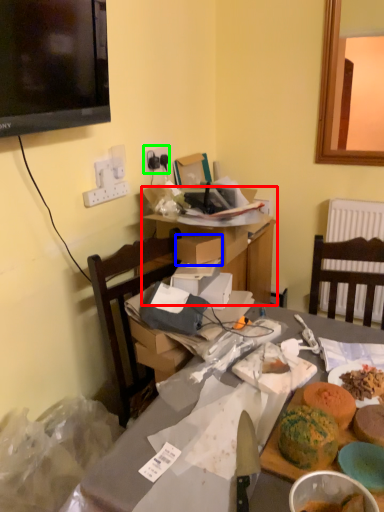
Question: Estimate the real-world distances between objects in this image. Which object is farther from table (highlighted by a red box), box (highlighted by a blue box) or electric outlet (highlighted by a green box)?

Choices:
 (A) box
 (B) electric outlet

Answer: (B)